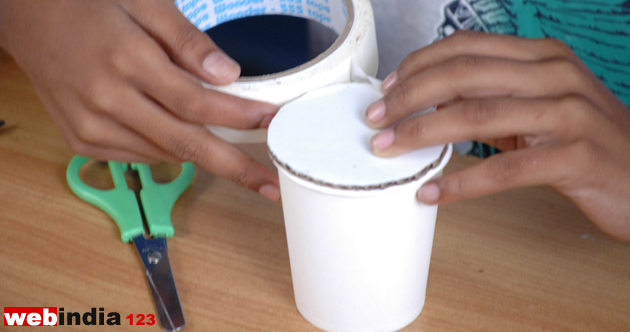
Identify the location of white cup. (369, 222).